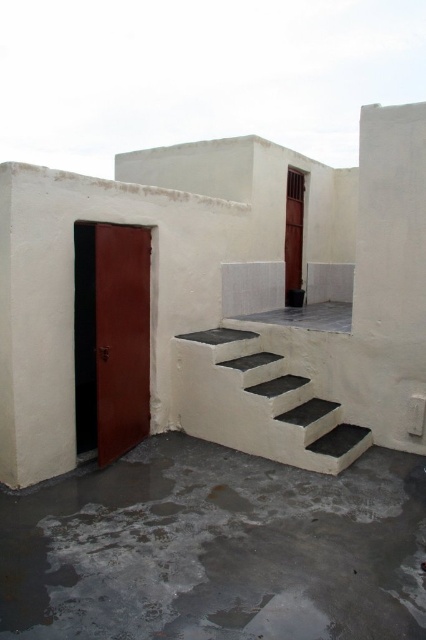
Question: Which object is closer to the camera taking this photo?

Choices:
 (A) white concrete stairs at center
 (B) gray concrete at center

Answer: (B)

Question: Considering the real-world distances, which object is closest to the satin wood door at center?

Choices:
 (A) gray concrete at center
 (B) white concrete stairs at center

Answer: (B)

Question: Does white concrete stairs at center have a larger size compared to satin wood door at center?

Choices:
 (A) no
 (B) yes

Answer: (B)

Question: Considering the real-world distances, which object is closest to the white concrete stairs at center?

Choices:
 (A) satin wood door at center
 (B) gray concrete at center

Answer: (B)

Question: Does gray concrete at center appear on the left side of satin wood door at center?

Choices:
 (A) no
 (B) yes

Answer: (A)

Question: Does gray concrete at center appear on the left side of satin wood door at center?

Choices:
 (A) no
 (B) yes

Answer: (A)